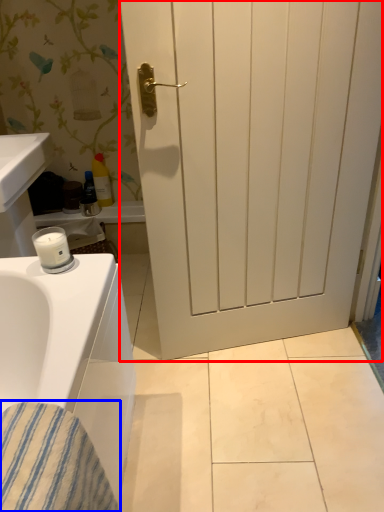
Question: Which point is further to the camera, door (highlighted by a red box) or material (highlighted by a blue box)?

Choices:
 (A) door
 (B) material

Answer: (A)